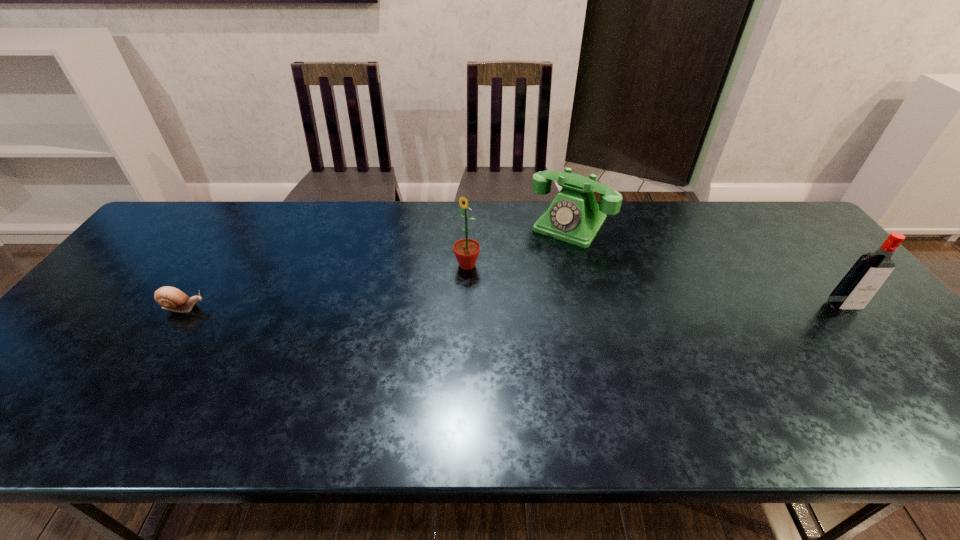
Locate an element on the screen. Image resolution: width=960 pixels, height=540 pixels. free spot on the desktop that is between the leftmost object and the rightmost object and is positioned on the dial of the telephone is located at coordinates (512, 307).

You are a GUI agent. You are given a task and a screenshot of the screen. Output one action in this format:
    pyautogui.click(x=<x>, y=<y>)
    Task: Click on the vacant space on the desktop that is between the leftmost object and the rightmost object and is positioned on the face of the sunflower
    
    Given the screenshot: What is the action you would take?
    pyautogui.click(x=421, y=307)